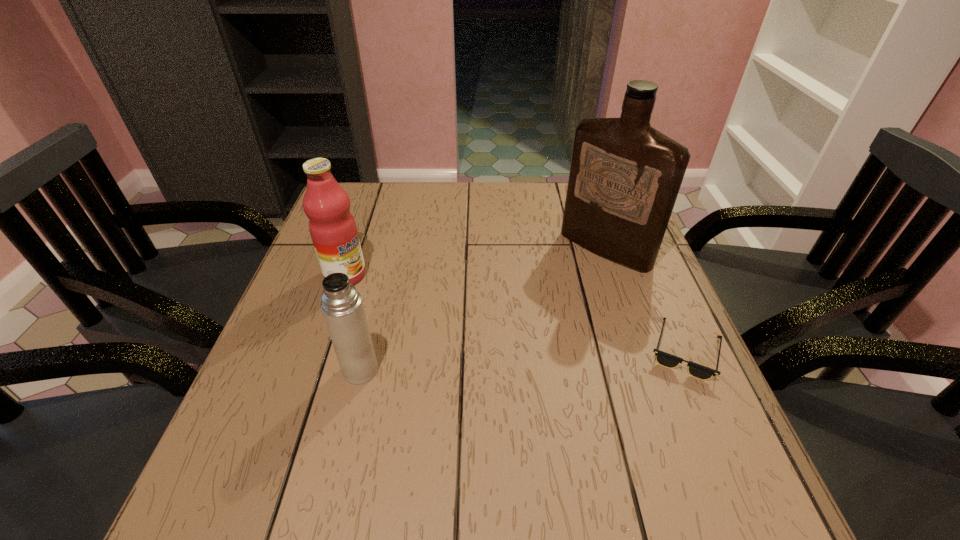
You are a GUI agent. You are given a task and a screenshot of the screen. Output one action in this format:
    pyautogui.click(x=<x>, y=<y>)
    Task: Click on the thermos bottle
    The width and height of the screenshot is (960, 540).
    Given the screenshot: What is the action you would take?
    pyautogui.click(x=342, y=306)

The width and height of the screenshot is (960, 540). I want to click on the third tallest object, so click(342, 306).

You are a GUI agent. You are given a task and a screenshot of the screen. Output one action in this format:
    pyautogui.click(x=<x>, y=<y>)
    Task: Click on the sunglasses
    
    Given the screenshot: What is the action you would take?
    pyautogui.click(x=665, y=359)

Locate an element on the screen. This screenshot has height=540, width=960. liquor is located at coordinates (625, 176).

This screenshot has height=540, width=960. In order to click on the leftmost object in this screenshot , I will do `click(332, 227)`.

Where is `fruit juice`? fruit juice is located at coordinates (332, 227).

At what (x,y) coordinates should I click in order to perform the action: click on free point located 0.210m on the right of the third object from right to left. Please return your answer as a coordinate pair (x, y). The height and width of the screenshot is (540, 960). Looking at the image, I should click on (482, 370).

The height and width of the screenshot is (540, 960). In order to click on blank space located 0.060m on the lenses of the sunglasses in this screenshot , I will do `click(712, 413)`.

Locate an element on the screen. This screenshot has height=540, width=960. free space located 0.120m on the label side of the tallest object is located at coordinates (557, 292).

Find the location of a particular element. This screenshot has width=960, height=540. vacant region located 0.110m on the label side of the tallest object is located at coordinates (559, 289).